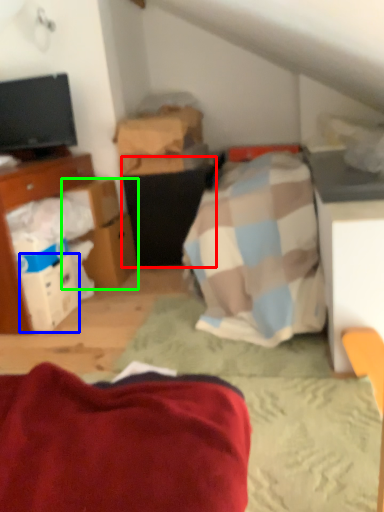
Question: Which object is positioned farthest from vanity (highlighted by a red box)? Select from box (highlighted by a blue box) and cardboard box (highlighted by a green box).

Choices:
 (A) box
 (B) cardboard box

Answer: (A)